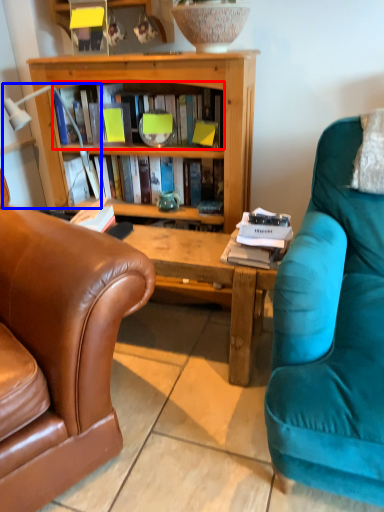
Question: Which object is further to the camera taking this photo, book (highlighted by a red box) or lamp (highlighted by a blue box)?

Choices:
 (A) book
 (B) lamp

Answer: (A)